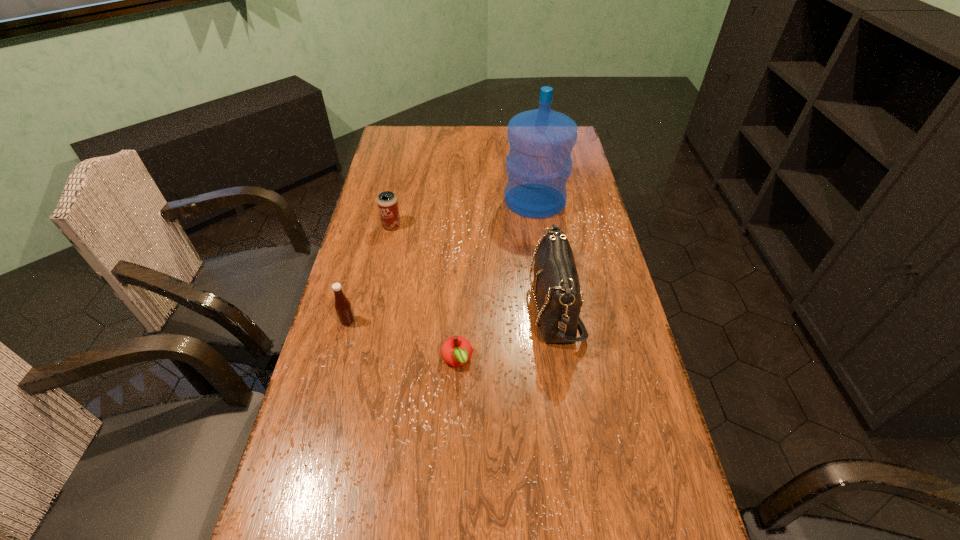
You are a GUI agent. You are given a task and a screenshot of the screen. Output one action in this format:
    pyautogui.click(x=<x>, y=<y>)
    Task: Click on the tallest object
    The width and height of the screenshot is (960, 540).
    Given the screenshot: What is the action you would take?
    pyautogui.click(x=539, y=163)

The image size is (960, 540). In order to click on handbag in this screenshot , I will do `click(557, 288)`.

This screenshot has width=960, height=540. Identify the location of the fourth shortest object. (343, 307).

Identify the location of the third shortest object. The height and width of the screenshot is (540, 960). (387, 203).

At what (x,y) coordinates should I click in order to perform the action: click on the fourth object from left to right. Please return your answer as a coordinate pair (x, y). Looking at the image, I should click on (456, 351).

Image resolution: width=960 pixels, height=540 pixels. Identify the location of vacant space situated on the back of the water jug. click(x=527, y=145).

This screenshot has width=960, height=540. Identify the location of vacant space located at the front of the handbag with chain and zipper. (427, 306).

At what (x,y) coordinates should I click in order to perform the action: click on vacant region located at the front of the handbag with chain and zipper. Please return your answer as a coordinate pair (x, y). Image resolution: width=960 pixels, height=540 pixels. Looking at the image, I should click on (484, 306).

I want to click on vacant point located 0.220m at the front of the handbag with chain and zipper, so click(x=452, y=306).

Locate an element on the screen. The width and height of the screenshot is (960, 540). vacant space located on the right of the third tallest object is located at coordinates (450, 321).